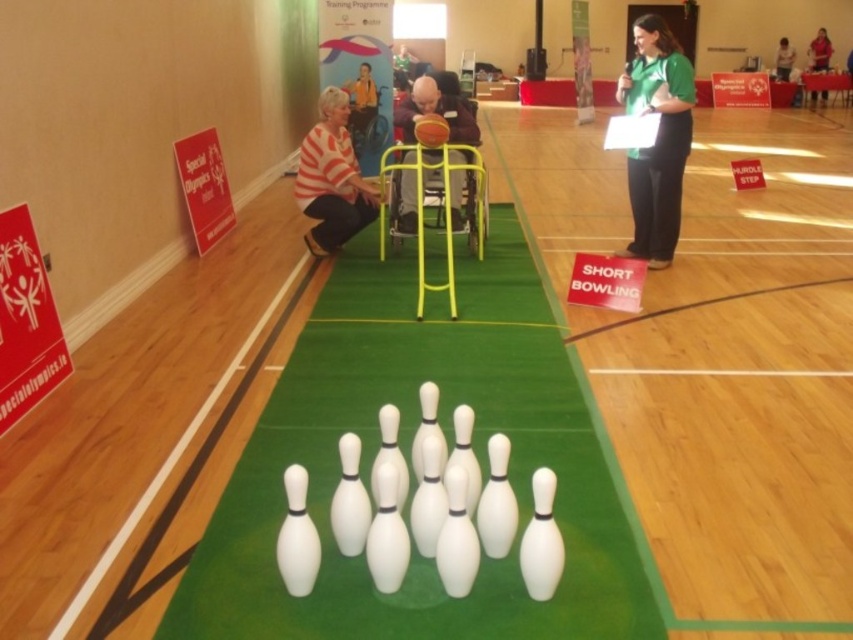
Question: From the image, what is the correct spatial relationship of matte green shirt at upper center in relation to green fabric shirt at upper center?

Choices:
 (A) right
 (B) left

Answer: (A)

Question: Among these points, which one is nearest to the camera?

Choices:
 (A) (364, 106)
 (B) (820, 44)
 (C) (788, 67)

Answer: (A)

Question: Among these objects, which one is farthest from the camera?

Choices:
 (A) white striped shirt at center
 (B) white plastic bowling pins at center
 (C) green fabric shirt at upper center

Answer: (C)

Question: Does white striped shirt at center have a smaller size compared to green fabric shirt at upper center?

Choices:
 (A) no
 (B) yes

Answer: (A)

Question: Which point is closer to the camera?

Choices:
 (A) (357, 115)
 (B) (786, 61)
 (C) (824, 35)
 (D) (335, 96)

Answer: (D)

Question: Is the position of green fabric shirt at upper right more distant than that of matte green shirt at upper center?

Choices:
 (A) yes
 (B) no

Answer: (B)